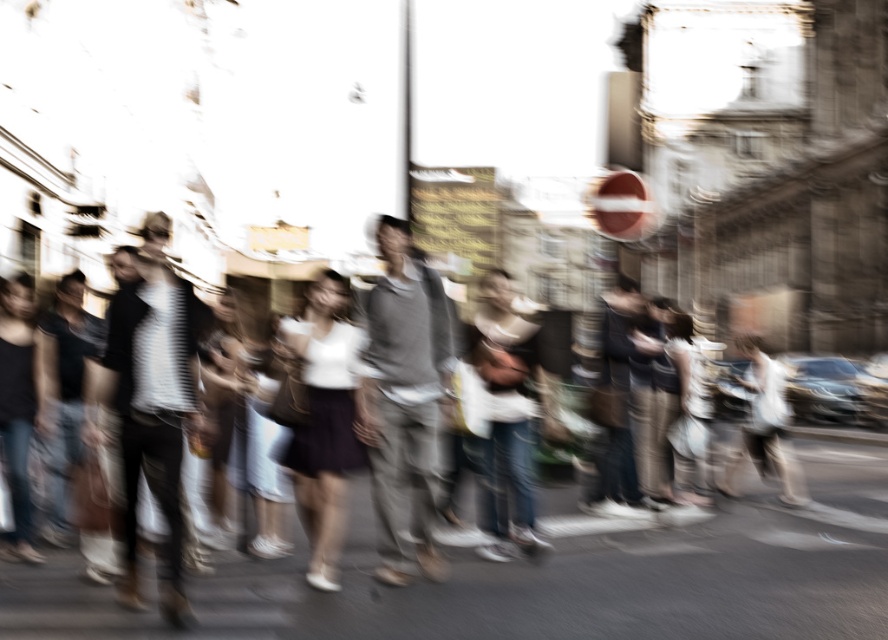
You are a photographer trying to capture a closeup of the matte gray pants at center and the gray fabric skateboard at center in the blurred urban scene. Since both are at the center, which one is positioned more to the right?

The matte gray pants at center is to the right of gray fabric skateboard at center, so the matte gray pants at center is positioned more to the right.

You are standing on the street and want to reach a specific point marked at coordinates point [732,609]. If your current position is 60 feet away from that point, can you walk directly to it without needing to adjust your path?

The distance of point [732,609] from viewer is 65.47 feet, so you are currently 60 feet away, meaning you need to walk an additional 5.47 feet to reach it directly without needing to adjust your path.

You are a delivery robot with a 3 meter long package. You need to move through the space between the matte gray pants at center and the gray fabric skateboard at center. Can your package fit through the space between them?

The matte gray pants at center and gray fabric skateboard at center are 3.15 meters apart from each other. Since the package is 3 meters long, it can fit through the space between them as there is enough clearance.